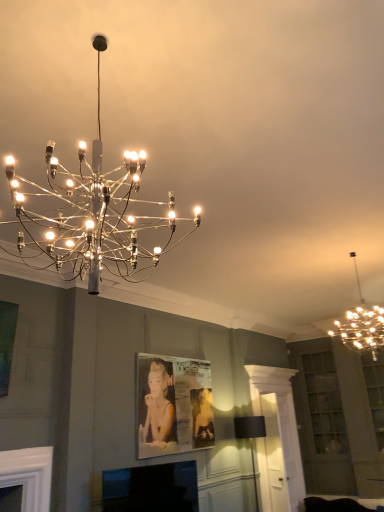
Question: Based on their positions, is black glossy tv at lower center located to the left or right of metallic chandelier at upper center, which appears as the 3th lamp when viewed from the back?

Choices:
 (A) left
 (B) right

Answer: (A)

Question: Considering the positions of black glossy tv at lower center and metallic chandelier at upper center, the 1th lamp from the left, in the image, is black glossy tv at lower center taller or shorter than metallic chandelier at upper center, the 1th lamp from the left,?

Choices:
 (A) tall
 (B) short

Answer: (B)

Question: Which object is the farthest from the metallic chandelier at upper right, which appears as the second lamp when viewed from the back?

Choices:
 (A) metallic chandelier at upper center, which is counted as the third lamp, starting from the right
 (B) metallic silver picture frame at center
 (C) black fabric lampshade at lower center, marked as the 2th lamp in a left-to-right arrangement
 (D) black glossy tv at lower center

Answer: (A)

Question: Based on their relative distances, which object is farther from the black glossy tv at lower center?

Choices:
 (A) black fabric lampshade at lower center, which is the 1th lamp in back-to-front order
 (B) metallic chandelier at upper right, the second lamp from the front
 (C) metallic chandelier at upper center, which is counted as the 1th lamp, starting from the top
 (D) metallic silver picture frame at center

Answer: (B)